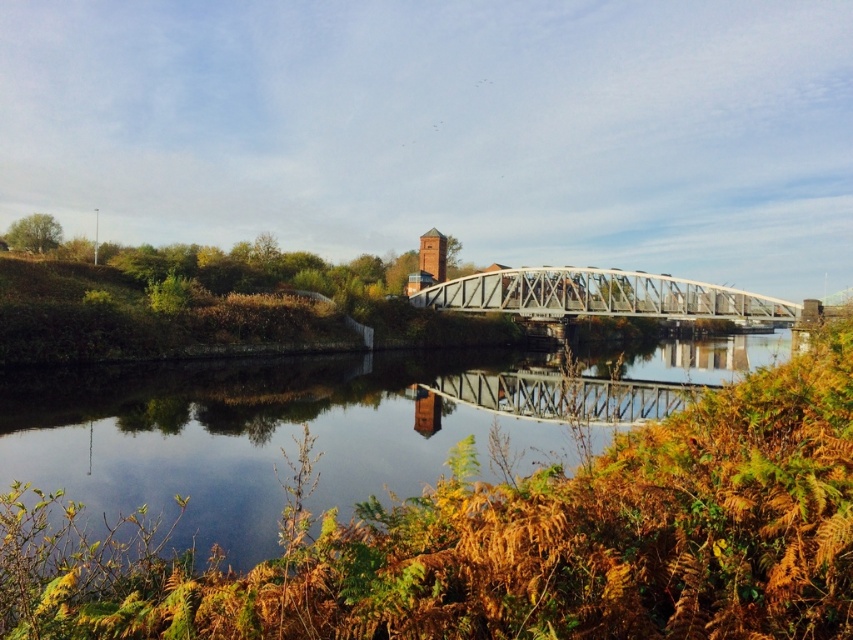
You are standing at the riverside and see the point marked at coordinates (236, 436). Based on the scene description, where exactly is this point located?

The point at (236, 436) is located on the smooth reflective water at center, which is in the middle ground of the riverside scene.

You are standing on the riverside and want to cross the river using the metallic gray bridge at center. However, there is smooth reflective water at center in your path. Which object should you avoid stepping on to reach the bridge safely?

You should avoid stepping on the smooth reflective water at center because it is located to the right of the metallic gray bridge at center, meaning the bridge is on your left side. To reach the bridge safely, step onto the solid ground instead of the water.